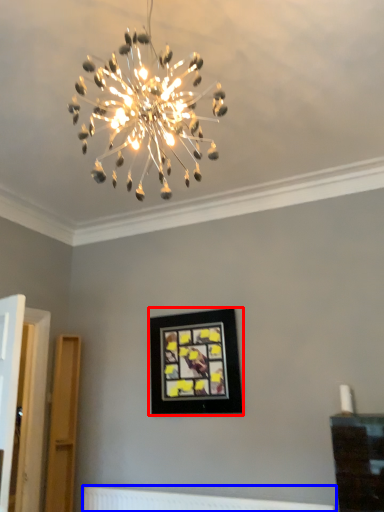
Question: Which object is further to the camera taking this photo, picture frame (highlighted by a red box) or radiator (highlighted by a blue box)?

Choices:
 (A) picture frame
 (B) radiator

Answer: (A)